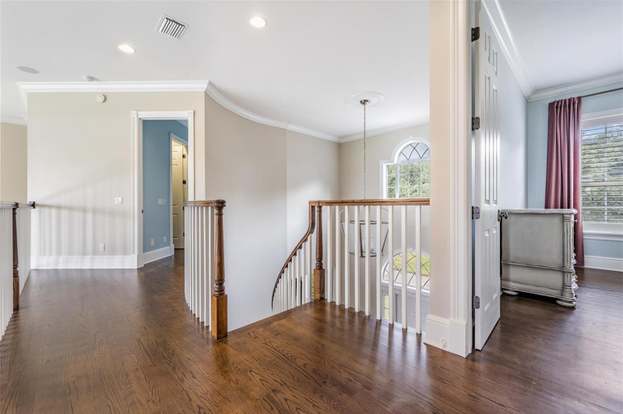
The image size is (623, 414). I want to click on white door, so click(x=487, y=198).